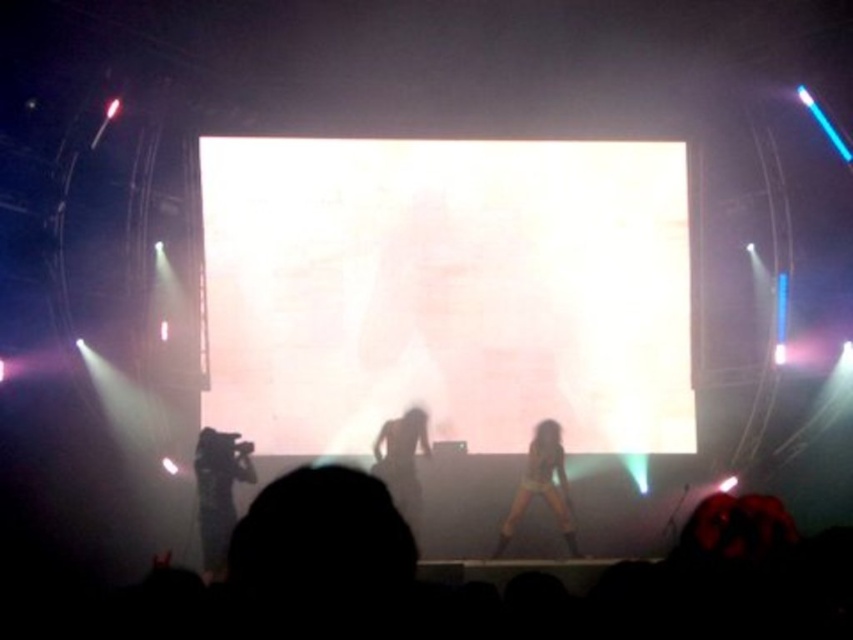
Question: Which of the following is the farthest from the observer?

Choices:
 (A) bright white matte projection screen at center
 (B) skinny jeans at center
 (C) smooth skin at center
 (D) dark fabric camera at lower left

Answer: (A)

Question: Observing the image, what is the correct spatial positioning of skinny jeans at center in reference to smooth skin at center?

Choices:
 (A) right
 (B) left

Answer: (A)

Question: Which point is farther to the camera?

Choices:
 (A) (368, 380)
 (B) (378, 452)
 (C) (200, 456)

Answer: (A)

Question: Which object is farther from the camera taking this photo?

Choices:
 (A) smooth skin at center
 (B) skinny jeans at center

Answer: (A)

Question: Is dark fabric camera at lower left thinner than smooth skin at center?

Choices:
 (A) yes
 (B) no

Answer: (A)

Question: Where is dark fabric camera at lower left located in relation to smooth skin at center in the image?

Choices:
 (A) below
 (B) above

Answer: (A)